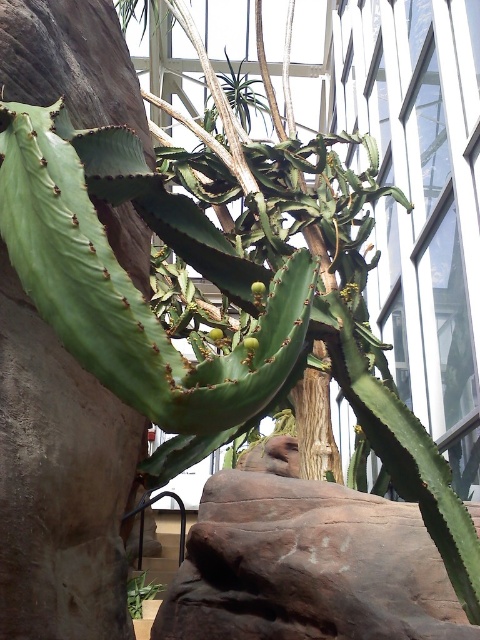
Question: Can you confirm if green succulent at center is bigger than green matte plant at lower left?

Choices:
 (A) yes
 (B) no

Answer: (A)

Question: Which of the following is the farthest from the observer?

Choices:
 (A) (236, 86)
 (B) (437, 572)
 (C) (141, 577)

Answer: (A)

Question: Is brown rough rock at center bigger than green succulent at center?

Choices:
 (A) yes
 (B) no

Answer: (A)

Question: Which object is the farthest from the green matte plant at lower left?

Choices:
 (A) green succulent at center
 (B) brown rough rock at center

Answer: (A)

Question: Which object is closer to the camera taking this photo?

Choices:
 (A) brown rough rock at center
 (B) green matte plant at lower left
 (C) green succulent at center

Answer: (A)

Question: Can you confirm if brown rough rock at center is positioned above green matte plant at lower left?

Choices:
 (A) no
 (B) yes

Answer: (B)